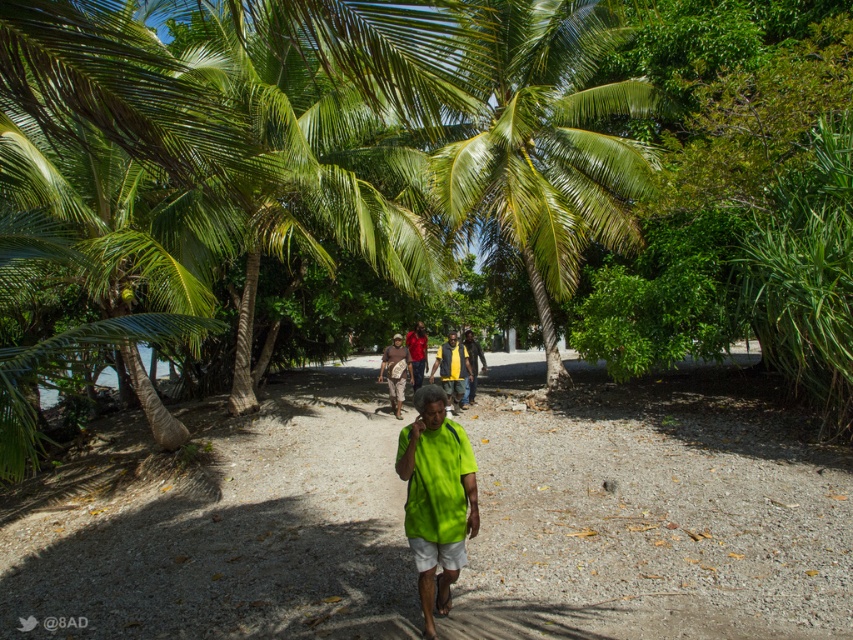
You are a photographer trying to capture a clear shot of the matte red shirt at center without the green leafy palm tree at center blocking it. Based on the scene, is this possible? Explain why or why not.

The green leafy palm tree at center is in front of the matte red shirt at center, so it will block the view. To capture the matte red shirt at center clearly, you need to move around the palm tree or adjust your angle to avoid the obstruction.

You are standing on the sandy path in the tropical setting. There are two points marked on the path at coordinates point (297, 561) and point (473, 401). Which point is closer to you?

Point (297, 561) is closer to the camera than point (473, 401), so the point closer to you is point (297, 561).